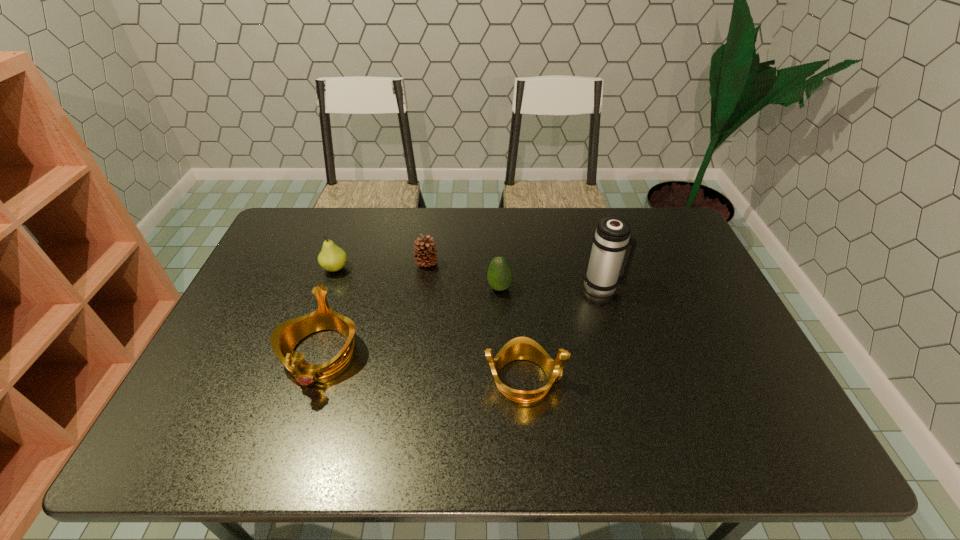
Observe the arrangement of all tiaras in the image. To keep them evenly spaced, where would you place another tiara on the right? Please locate a free space. Please provide its 2D coordinates. Your answer should be formatted as a tuple, i.e. [(x, y)], where the tuple contains the x and y coordinates of a point satisfying the conditions above.

[(752, 407)]